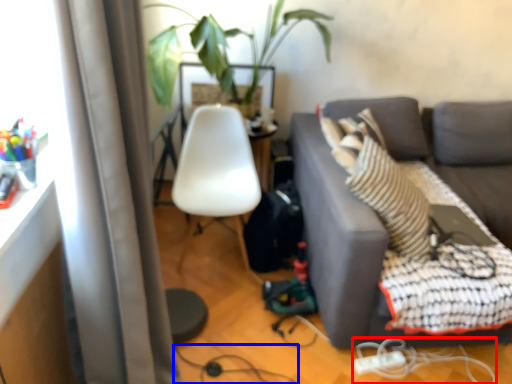
Question: Among these objects, which one is nearest to the camera, cable (highlighted by a red box) or cable (highlighted by a blue box)?

Choices:
 (A) cable
 (B) cable

Answer: (A)